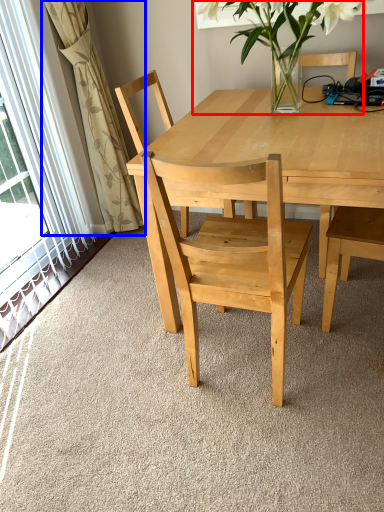
Question: Among these objects, which one is farthest to the camera, houseplant (highlighted by a red box) or curtain (highlighted by a blue box)?

Choices:
 (A) houseplant
 (B) curtain

Answer: (B)